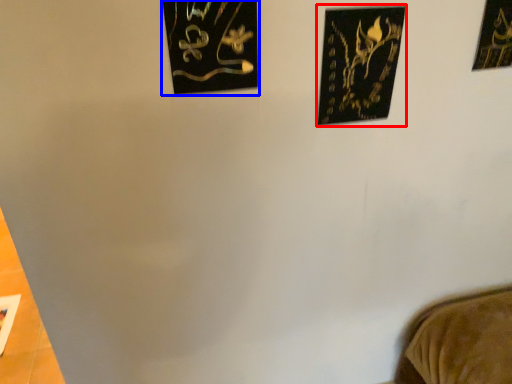
Question: Which object appears closest to the camera in this image, picture frame (highlighted by a red box) or picture frame (highlighted by a blue box)?

Choices:
 (A) picture frame
 (B) picture frame

Answer: (B)